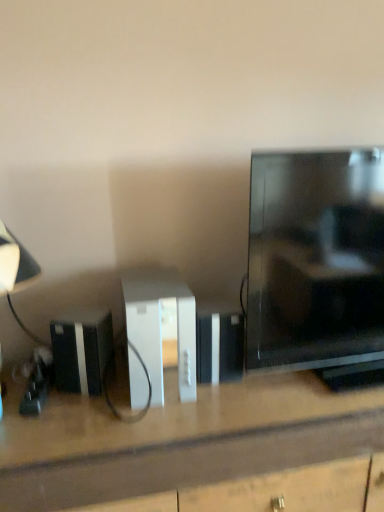
Where is `free space in front of matte black lampshade at left`? This screenshot has width=384, height=512. free space in front of matte black lampshade at left is located at coordinates (37, 450).